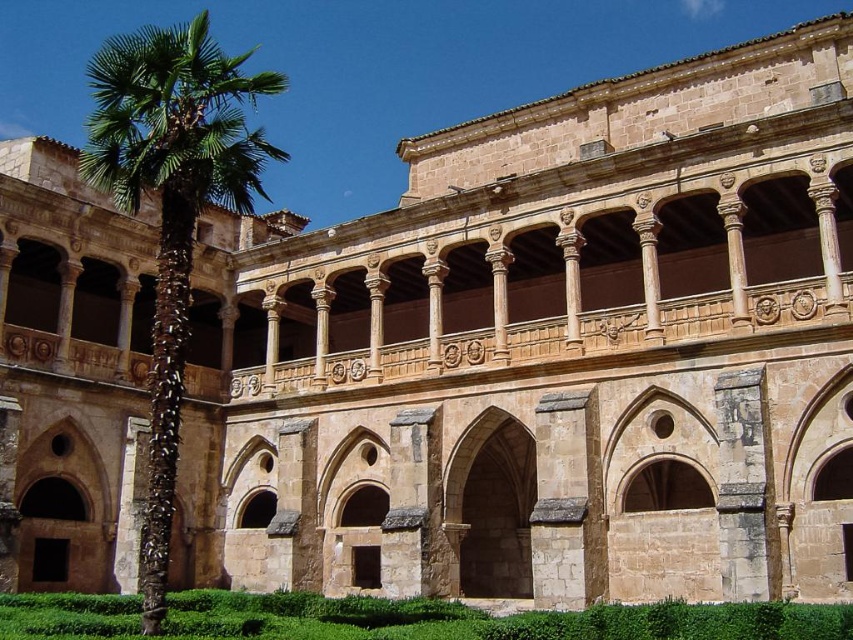
You are standing in front of the grand building and notice a green leafy palm at left and a green leafy hedge at lower center. Which of these plants is located higher up in the scene?

The green leafy palm at left is positioned over the green leafy hedge at lower center, so it is higher up in the scene.

You are standing in front of the grand building and want to walk towards the green leafy palm at left and the green leafy hedge at lower center. Which one will you reach first?

The green leafy palm at left is closer to you than the green leafy hedge at lower center, so you will reach the green leafy palm at left first.